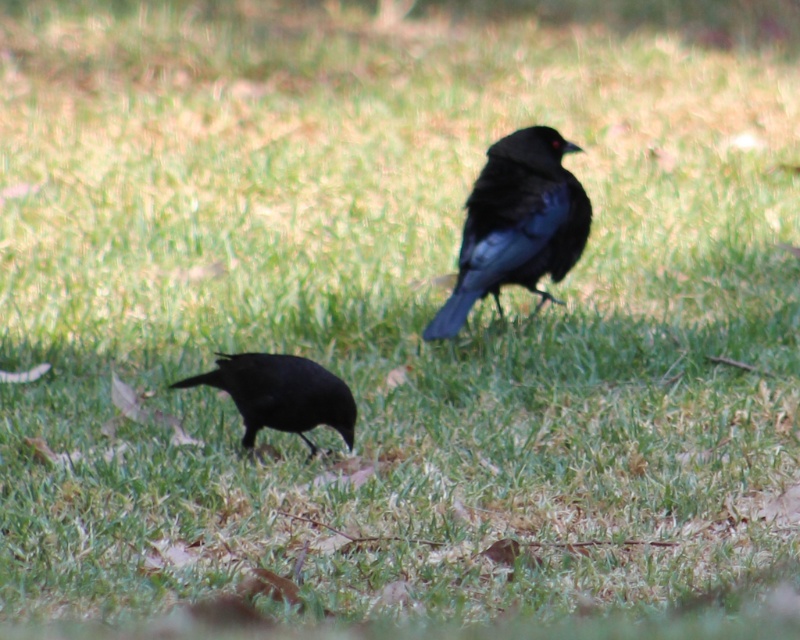
Which is in front, point (446, 317) or point (312, 422)?

Positioned in front is point (312, 422).

Is shiny black crow at upper right wider than shiny black crow at lower left?

Yes, shiny black crow at upper right is wider than shiny black crow at lower left.

What do you see at coordinates (516, 224) in the screenshot? I see `shiny black crow at upper right` at bounding box center [516, 224].

I want to click on shiny black crow at upper right, so click(x=516, y=224).